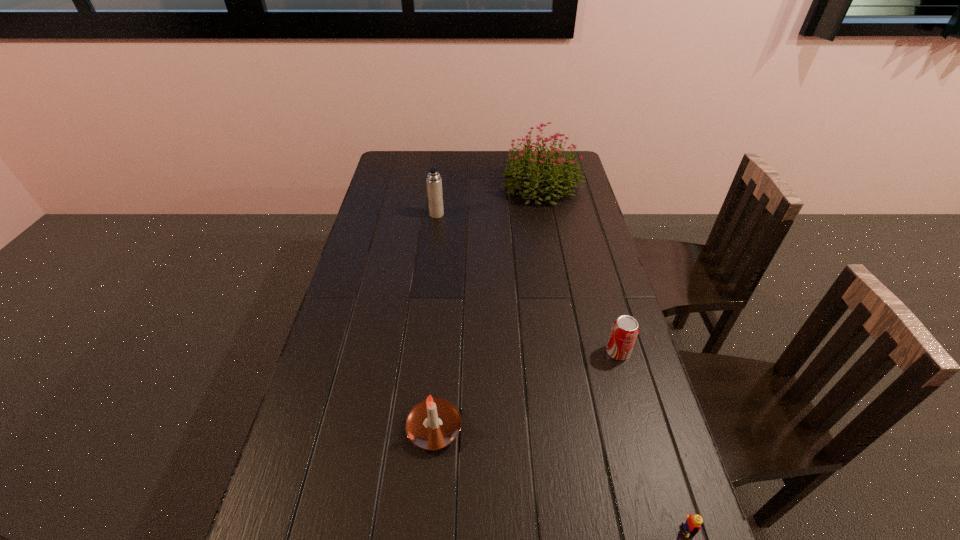
At what (x,y) coordinates should I click in order to perform the action: click on vacant point located 0.200m on the front of the soda can. Please return your answer as a coordinate pair (x, y). This screenshot has width=960, height=540. Looking at the image, I should click on (640, 431).

I want to click on object at the far edge, so click(x=555, y=177).

The height and width of the screenshot is (540, 960). Find the location of `bouquet at the right edge`. bouquet at the right edge is located at coordinates (555, 177).

This screenshot has width=960, height=540. What are the coordinates of `soda can that is at the right edge` in the screenshot? It's located at (625, 329).

The height and width of the screenshot is (540, 960). I want to click on object that is at the far right corner, so click(x=555, y=177).

At what (x,y) coordinates should I click in order to perform the action: click on vacant space at the far edge of the desktop. Please return your answer as a coordinate pair (x, y). This screenshot has width=960, height=540. Looking at the image, I should click on (431, 159).

This screenshot has height=540, width=960. I want to click on free spot at the left edge of the desktop, so click(x=383, y=309).

Find the location of `vacant space at the right edge of the desktop`. vacant space at the right edge of the desktop is located at coordinates (571, 226).

Identify the location of free spot between the soda can and the farthest object. (580, 268).

The height and width of the screenshot is (540, 960). I want to click on free spot between the tallest object and the candle, so click(488, 307).